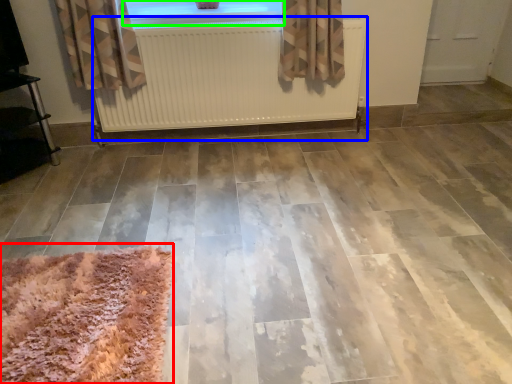
Question: Which object is positioned closest to mat (highlighted by a red box)? Select from radiator (highlighted by a blue box) and window (highlighted by a green box).

Choices:
 (A) radiator
 (B) window

Answer: (A)